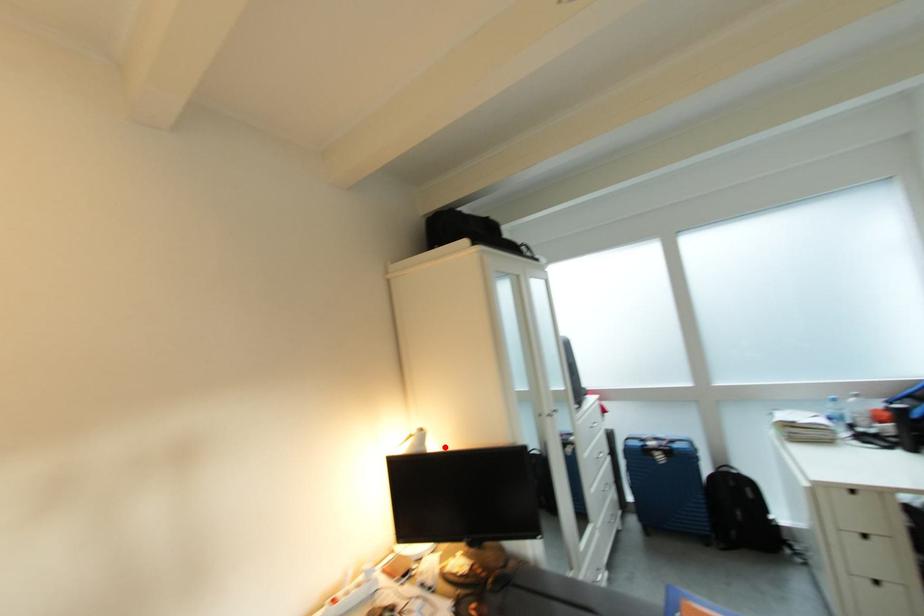
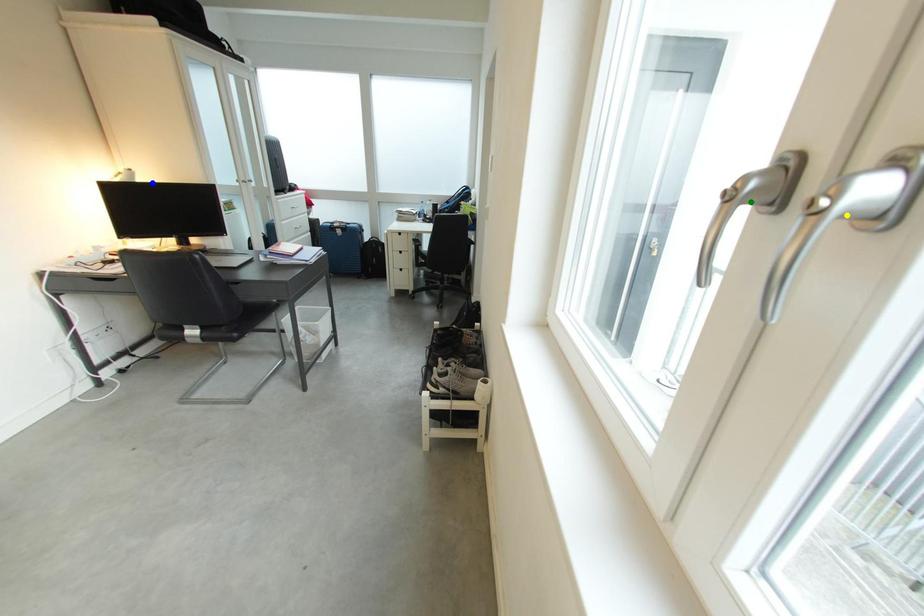
Question: I am providing you with two images of the same scene from different viewpoints. A red point is marked on the first image. You are given multiple points on the second image. Which point in image 2 represents the same 3d spot as the red point in image 1?

Choices:
 (A) yellow point
 (B) green point
 (C) blue point

Answer: (C)